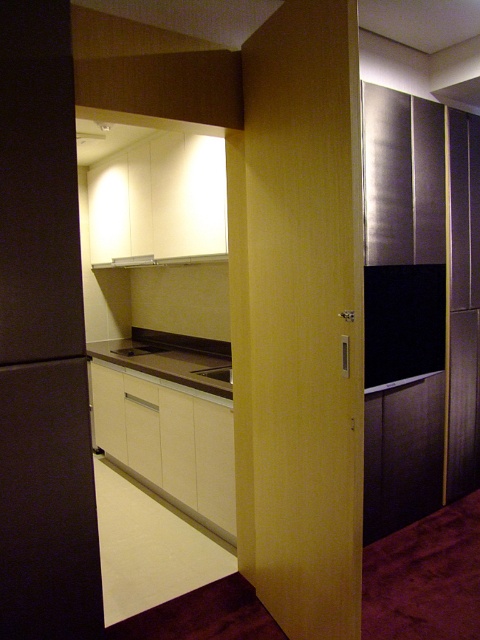
Between point (136, 352) and point (218, 372), which one is positioned in front?

Positioned in front is point (218, 372).

Identify the location of brown laminate countertop at center. This screenshot has height=640, width=480. (171, 358).